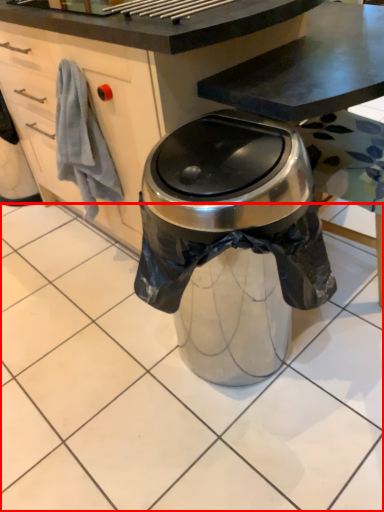
Question: From the image, what is the correct spatial relationship of tile (annotated by the red box) in relation to cabinetry?

Choices:
 (A) left
 (B) right

Answer: (B)